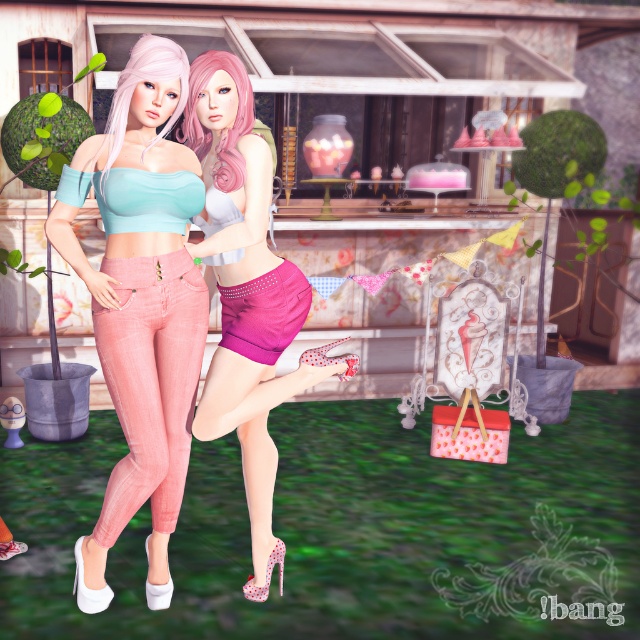
Question: Can you confirm if matte pink shorts at center is positioned above matte pink jeans at lower left?

Choices:
 (A) yes
 (B) no

Answer: (A)

Question: Estimate the real-world distances between objects in this image. Which object is farther from the matte pink jeans at center?

Choices:
 (A) matte pink shorts at center
 (B) shiny magenta shorts at center

Answer: (B)

Question: Is the position of matte pink jeans at center more distant than that of matte pink shorts at center?

Choices:
 (A) yes
 (B) no

Answer: (B)

Question: Considering the real-world distances, which object is farthest from the shiny magenta shorts at center?

Choices:
 (A) matte pink jeans at lower left
 (B) matte pink shorts at center

Answer: (A)

Question: Is matte pink shorts at center positioned at the back of shiny magenta shorts at center?

Choices:
 (A) no
 (B) yes

Answer: (A)

Question: Which point is farther to the camera?

Choices:
 (A) shiny magenta shorts at center
 (B) matte pink shorts at center
 (C) matte pink jeans at lower left
 (D) matte pink jeans at center

Answer: (A)